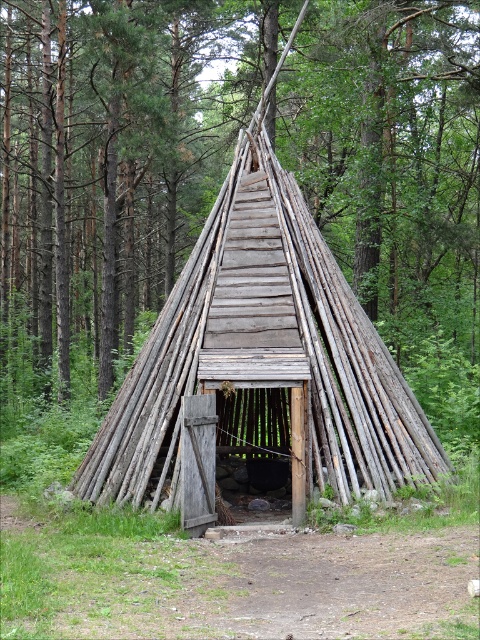
Who is positioned more to the left, wooden hut at center or weathered wood hut at center?

From the viewer's perspective, wooden hut at center appears more on the left side.

Is wooden hut at center closer to camera compared to weathered wood hut at center?

No, it is not.

This screenshot has height=640, width=480. Describe the element at coordinates (116, 154) in the screenshot. I see `wooden hut at center` at that location.

Where is `wooden hut at center`? This screenshot has width=480, height=640. wooden hut at center is located at coordinates (116, 154).